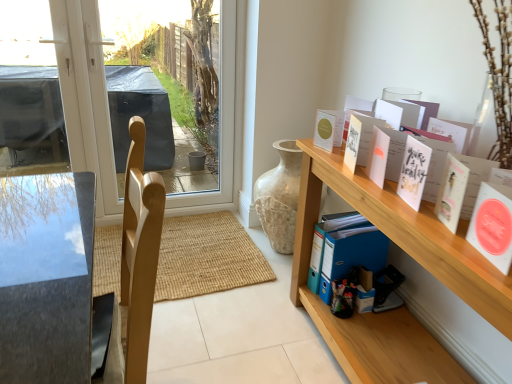
Where is `free point in front of white paper card at upper right, the second book when ordered from back to front`? The height and width of the screenshot is (384, 512). free point in front of white paper card at upper right, the second book when ordered from back to front is located at coordinates (430, 229).